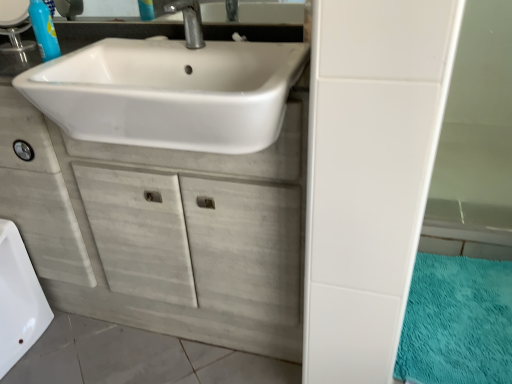
The height and width of the screenshot is (384, 512). Describe the element at coordinates (162, 231) in the screenshot. I see `white wood cabinet at center` at that location.

Describe the element at coordinates (44, 30) in the screenshot. I see `blue plastic soap dispenser at upper left` at that location.

Where is `white glossy sink at upper center`? The width and height of the screenshot is (512, 384). white glossy sink at upper center is located at coordinates (169, 93).

In order to face teal plush bath mat at lower right, should I rotate leftwards or rightwards?

You should look right and rotate roughly 25.660 degrees.

The height and width of the screenshot is (384, 512). What do you see at coordinates (18, 299) in the screenshot?
I see `white glossy bath at lower left` at bounding box center [18, 299].

Locate an element on the screen. The height and width of the screenshot is (384, 512). white wood cabinet at center is located at coordinates (162, 231).

Does metallic silver faucet at upper center have a larger size compared to white wood cabinet at center?

Incorrect, metallic silver faucet at upper center is not larger than white wood cabinet at center.

Where is `tap that is above the white wood cabinet at center (from the image's perspective)`? Image resolution: width=512 pixels, height=384 pixels. tap that is above the white wood cabinet at center (from the image's perspective) is located at coordinates (188, 21).

Which object is positioned more to the left, metallic silver faucet at upper center or white wood cabinet at center?

Positioned to the left is white wood cabinet at center.

Does metallic silver faucet at upper center have a lesser width compared to white wood cabinet at center?

Indeed, metallic silver faucet at upper center has a lesser width compared to white wood cabinet at center.

Looking at this image, is blue plastic soap dispenser at upper left positioned with its back to metallic silver faucet at upper center?

No, metallic silver faucet at upper center is not at the back of blue plastic soap dispenser at upper left.

Considering the relative sizes of blue plastic soap dispenser at upper left and metallic silver faucet at upper center in the image provided, is blue plastic soap dispenser at upper left wider than metallic silver faucet at upper center?

No.

Considering their positions, is blue plastic soap dispenser at upper left located in front of or behind metallic silver faucet at upper center?

Clearly, blue plastic soap dispenser at upper left is behind metallic silver faucet at upper center.

Is blue plastic soap dispenser at upper left inside or outside of metallic silver faucet at upper center?

blue plastic soap dispenser at upper left cannot be found inside metallic silver faucet at upper center.

Do you think white glossy sink at upper center is within teal plush bath mat at lower right, or outside of it?

white glossy sink at upper center is spatially situated outside teal plush bath mat at lower right.

Which point is more forward, (295,62) or (434,378)?

The point (295,62) is closer to the camera.

Considering the sizes of objects white glossy sink at upper center and teal plush bath mat at lower right in the image provided, who is thinner, white glossy sink at upper center or teal plush bath mat at lower right?

Thinner between the two is white glossy sink at upper center.

What's the angular difference between white glossy sink at upper center and teal plush bath mat at lower right's facing directions?

0.713 degrees.

From a real-world perspective, who is located higher, white glossy bath at lower left or teal plush bath mat at lower right?

white glossy bath at lower left, from a real-world perspective.

At what (x,y) coordinates should I click in order to perform the action: click on bath mat on the right side of white glossy bath at lower left. Please return your answer as a coordinate pair (x, y). This screenshot has width=512, height=384. Looking at the image, I should click on (457, 322).

Which is more to the right, white glossy bath at lower left or teal plush bath mat at lower right?

teal plush bath mat at lower right is more to the right.

Which is nearer, (12, 270) or (413, 337)?

Point (12, 270) appears to be farther away from the viewer than point (413, 337).

From the image's perspective, which one is positioned lower, blue plastic soap dispenser at upper left or white glossy sink at upper center?

white glossy sink at upper center is shown below in the image.

Which is further, (x=47, y=52) or (x=237, y=125)?

The point (x=47, y=52) is farther.

Considering the sizes of objects blue plastic soap dispenser at upper left and white glossy sink at upper center in the image provided, who is thinner, blue plastic soap dispenser at upper left or white glossy sink at upper center?

With smaller width is blue plastic soap dispenser at upper left.

Measure the distance between white glossy bath at lower left and white glossy sink at upper center.

The distance of white glossy bath at lower left from white glossy sink at upper center is 29.17 inches.

Can you confirm if white glossy bath at lower left is taller than white glossy sink at upper center?

Yes, white glossy bath at lower left is taller than white glossy sink at upper center.

In the scene shown: Does white glossy bath at lower left turn towards white glossy sink at upper center?

No, white glossy bath at lower left does not turn towards white glossy sink at upper center.

From the image's perspective, is white glossy bath at lower left above white glossy sink at upper center?

No, from the image's perspective, white glossy bath at lower left is not on top of white glossy sink at upper center.

The image size is (512, 384). Find the location of `sink in front of the white wood cabinet at center`. sink in front of the white wood cabinet at center is located at coordinates (169, 93).

Consider the image. Considering the relative sizes of white wood cabinet at center and white glossy sink at upper center in the image provided, is white wood cabinet at center smaller than white glossy sink at upper center?

Actually, white wood cabinet at center might be larger than white glossy sink at upper center.

Is white wood cabinet at center shorter than white glossy sink at upper center?

No, white wood cabinet at center is not shorter than white glossy sink at upper center.

Between white wood cabinet at center and white glossy sink at upper center, which one appears on the left side from the viewer's perspective?

white wood cabinet at center.

I want to click on bathroom cabinet below the metallic silver faucet at upper center (from the image's perspective), so click(162, 231).

Image resolution: width=512 pixels, height=384 pixels. Identify the location of tap above the blue plastic soap dispenser at upper left (from a real-world perspective). (188, 21).

Looking at the image, which one is located closer to white glossy sink at upper center, metallic silver faucet at upper center or blue plastic soap dispenser at upper left?

metallic silver faucet at upper center is positioned closer to the anchor white glossy sink at upper center.

Considering their positions, is white glossy sink at upper center positioned closer to white glossy bath at lower left than teal plush bath mat at lower right?

white glossy sink at upper center lies closer to white glossy bath at lower left than the other object.

Based on their spatial positions, is white glossy bath at lower left or blue plastic soap dispenser at upper left closer to metallic silver faucet at upper center?

Based on the image, blue plastic soap dispenser at upper left appears to be nearer to metallic silver faucet at upper center.

Which object lies nearer to the anchor point blue plastic soap dispenser at upper left, white wood cabinet at center or white glossy sink at upper center?

white glossy sink at upper center is closer to blue plastic soap dispenser at upper left.

From the image, which object appears to be nearer to white glossy sink at upper center, white glossy bath at lower left or white wood cabinet at center?

white wood cabinet at center lies closer to white glossy sink at upper center than the other object.

Estimate the real-world distances between objects in this image. Which object is closer to blue plastic soap dispenser at upper left, white wood cabinet at center or teal plush bath mat at lower right?

white wood cabinet at center.

Based on their spatial positions, is white glossy bath at lower left or metallic silver faucet at upper center closer to teal plush bath mat at lower right?

The object closer to teal plush bath mat at lower right is metallic silver faucet at upper center.

Looking at the image, which one is located further to metallic silver faucet at upper center, blue plastic soap dispenser at upper left or teal plush bath mat at lower right?

Based on the image, teal plush bath mat at lower right appears to be further to metallic silver faucet at upper center.

Locate an element on the screen. bathroom cabinet situated between white glossy bath at lower left and teal plush bath mat at lower right from left to right is located at coordinates (162, 231).

Find the location of a particular element. Image resolution: width=512 pixels, height=384 pixels. sink between blue plastic soap dispenser at upper left and teal plush bath mat at lower right is located at coordinates (169, 93).

Where is `bathroom cabinet between white glossy bath at lower left and white glossy sink at upper center from left to right`? This screenshot has width=512, height=384. bathroom cabinet between white glossy bath at lower left and white glossy sink at upper center from left to right is located at coordinates (162, 231).

Identify the location of sink between metallic silver faucet at upper center and white wood cabinet at center from top to bottom. Image resolution: width=512 pixels, height=384 pixels. (169, 93).